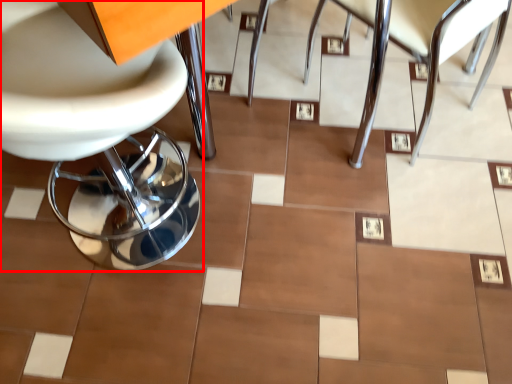
Question: From the image's perspective, considering the relative positions of chair (annotated by the red box) and chair in the image provided, where is chair (annotated by the red box) located with respect to the staircase?

Choices:
 (A) above
 (B) below

Answer: (B)